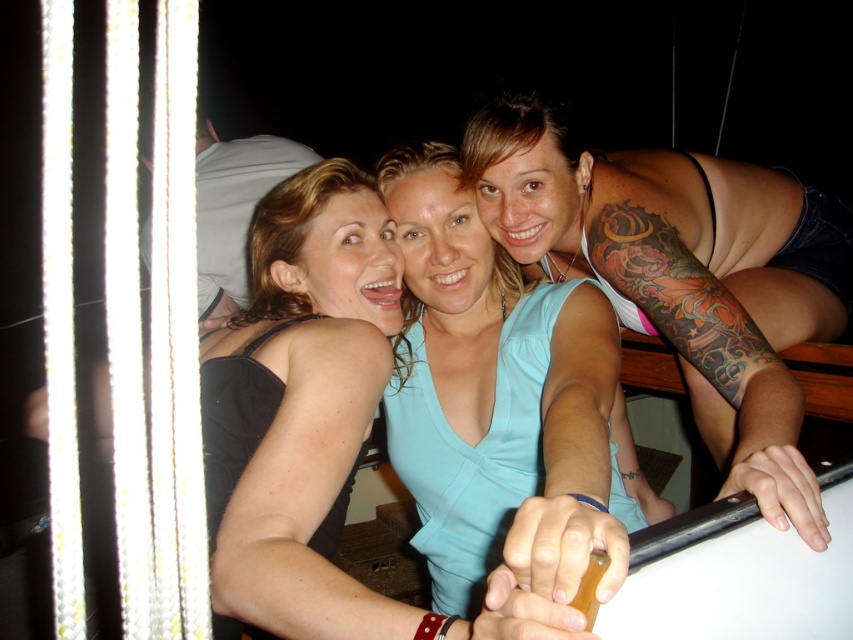
You are standing at the center of the image and want to touch the point at coordinates [682,273]. Which object should you reach for to touch that point?

The point at coordinates [682,273] is located on the blue fabric top at upper right, so you should reach for the blue fabric top at upper right to touch that point.

Consider the image. You are standing in the scene and want to move from the point at coordinates point(813, 220) to the point at coordinates point(412, 225). Which direction should you move to get closer to the second point?

To move from point(813, 220) to point(412, 225), you should move downward and slightly to the right since the second point is lower and slightly to the right of the first point.